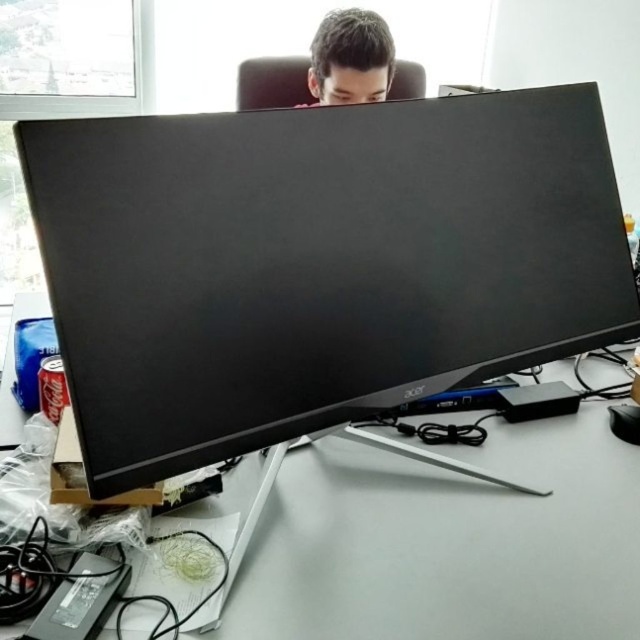
You are standing in front of the workspace and want to reach both points mentioned. Which point, point (205, 212) or point (556, 464), is closer to you?

Point (205, 212) is closer to the viewer than point (556, 464).

You are organizing your workspace and need to place a new item between the white plastic computer desk at center and the brown matte hair at upper center. Based on their positions, which object should you place the item closer to?

The item should be placed closer to the brown matte hair at upper center because the white plastic computer desk at center is positioned to the right of the brown matte hair at upper center, meaning the desk is farther away from the left side where the item would be placed between them.

You are standing in front of the workspace shown. You need to place a small object exactly at the point with coordinates point (276,573). How far will this object be from you?

The point (276,573) is 76.93 centimeters away from the viewer, so placing the object there will make it 76.93 centimeters away from you.